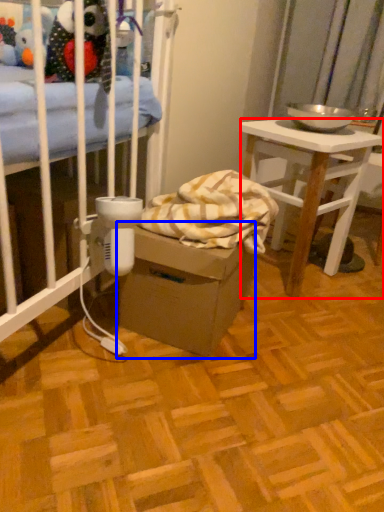
Question: Which of the following is the farthest to the observer, desk (highlighted by a red box) or cardboard box (highlighted by a blue box)?

Choices:
 (A) desk
 (B) cardboard box

Answer: (A)